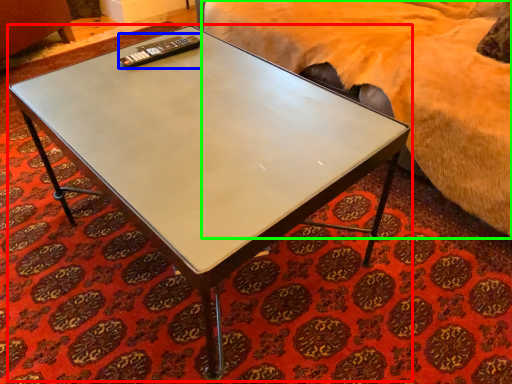
Question: Which is farther away from coffee table (highlighted by a red box)? remote (highlighted by a blue box) or bed (highlighted by a green box)?

Choices:
 (A) remote
 (B) bed

Answer: (B)